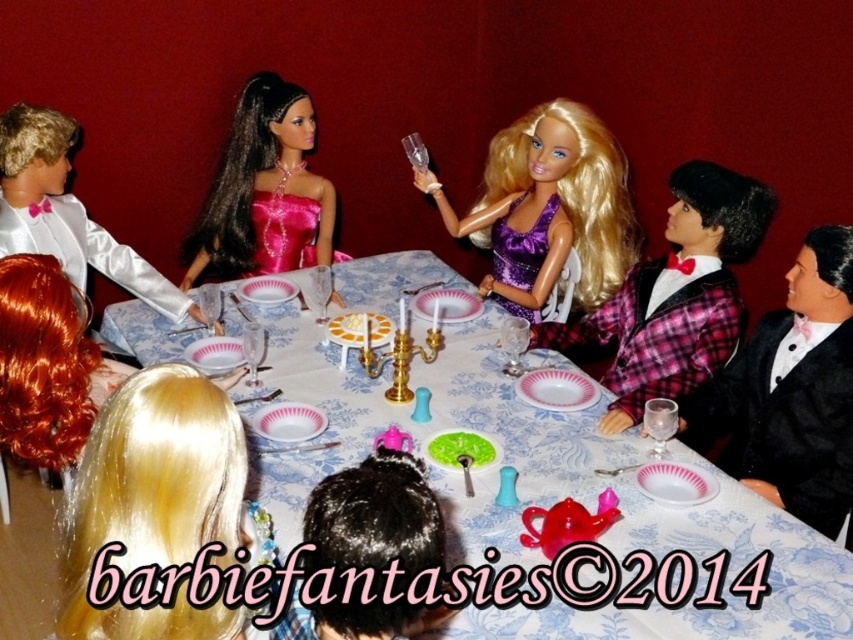
Question: Estimate the real-world distances between objects in this image. Which object is closer to the shiny orange wig at lower left?

Choices:
 (A) black satin tuxedo at right
 (B) blue floral tablecloth at center
 (C) purple satin dress at upper right

Answer: (B)

Question: Which object appears closest to the camera in this image?

Choices:
 (A) black satin tuxedo at right
 (B) purple satin dress at upper center
 (C) shiny orange wig at lower left

Answer: (C)

Question: Does blue floral tablecloth at center have a greater width compared to shiny pink satin dress at upper left?

Choices:
 (A) yes
 (B) no

Answer: (A)

Question: Among these objects, which one is farthest from the camera?

Choices:
 (A) shiny orange wig at lower left
 (B) blue floral tablecloth at center
 (C) white satin tuxedo at left
 (D) black satin tuxedo at right

Answer: (C)

Question: Can you confirm if shiny pink satin dress at upper left is smaller than shiny orange wig at lower left?

Choices:
 (A) yes
 (B) no

Answer: (B)

Question: Considering the relative positions of blue floral tablecloth at center and black satin tuxedo at right in the image provided, where is blue floral tablecloth at center located with respect to black satin tuxedo at right?

Choices:
 (A) above
 (B) below

Answer: (B)